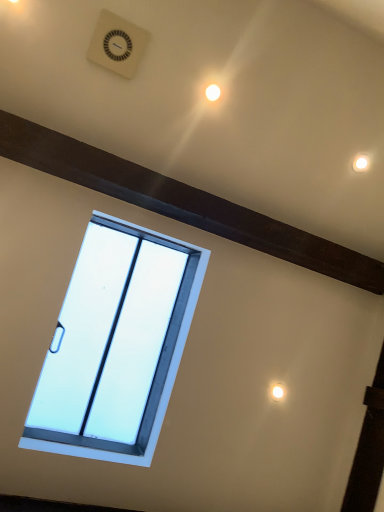
Question: Can you confirm if white plastic clock at upper center is thinner than white glossy light at upper center?

Choices:
 (A) yes
 (B) no

Answer: (B)

Question: Considering the relative sizes of white plastic clock at upper center and white glossy light at upper center in the image provided, is white plastic clock at upper center shorter than white glossy light at upper center?

Choices:
 (A) no
 (B) yes

Answer: (A)

Question: Are white plastic clock at upper center and white glossy light at upper center making contact?

Choices:
 (A) yes
 (B) no

Answer: (B)

Question: Considering the relative positions of white plastic clock at upper center and white glossy light at upper center in the image provided, is white plastic clock at upper center behind white glossy light at upper center?

Choices:
 (A) yes
 (B) no

Answer: (B)

Question: Is white plastic clock at upper center facing away from white glossy light at upper center?

Choices:
 (A) yes
 (B) no

Answer: (B)

Question: Is white plastic clock at upper center to the left of white glossy light at upper center from the viewer's perspective?

Choices:
 (A) no
 (B) yes

Answer: (B)

Question: Is white plastic window at center smaller than white glossy light at upper center?

Choices:
 (A) no
 (B) yes

Answer: (A)

Question: From the image's perspective, is white plastic window at center on top of white glossy light at upper center?

Choices:
 (A) no
 (B) yes

Answer: (A)

Question: From a real-world perspective, is white plastic window at center physically above white glossy light at upper center?

Choices:
 (A) no
 (B) yes

Answer: (A)

Question: Considering the relative positions of white plastic window at center and white glossy light at upper center in the image provided, is white plastic window at center in front of white glossy light at upper center?

Choices:
 (A) yes
 (B) no

Answer: (A)

Question: Does white plastic window at center contain white glossy light at upper center?

Choices:
 (A) no
 (B) yes

Answer: (A)

Question: Considering the relative positions of white plastic window at center and white glossy light at upper center in the image provided, is white plastic window at center behind white glossy light at upper center?

Choices:
 (A) yes
 (B) no

Answer: (B)

Question: From the image's perspective, is white plastic clock at upper center located beneath white plastic window at center?

Choices:
 (A) yes
 (B) no

Answer: (B)